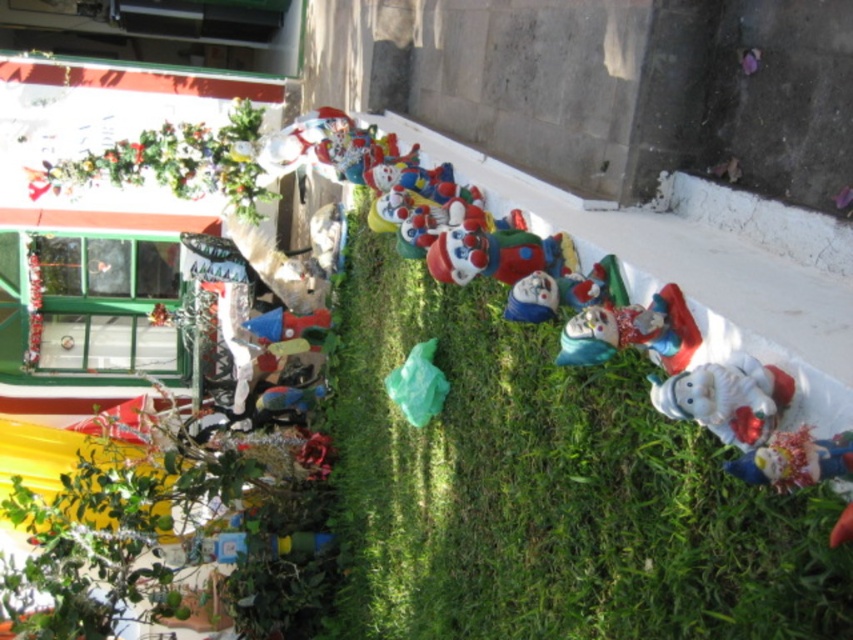
Question: Where is white glossy santa at lower right located in relation to shiny metallic clown at lower right in the image?

Choices:
 (A) above
 (B) below

Answer: (A)

Question: Which of the following is the farthest from the observer?

Choices:
 (A) (535, 624)
 (B) (674, 340)

Answer: (A)

Question: Can you confirm if green grass at center is positioned to the left of white glossy santa at lower right?

Choices:
 (A) yes
 (B) no

Answer: (A)

Question: Among these objects, which one is nearest to the camera?

Choices:
 (A) matte plastic clown at center
 (B) shiny metallic clown at lower right

Answer: (B)

Question: Can you confirm if green grass at center is positioned to the left of shiny metallic clown at lower right?

Choices:
 (A) no
 (B) yes

Answer: (B)

Question: Which is nearer to the white glossy santa at lower right?

Choices:
 (A) matte plastic clown at center
 (B) green grass at center

Answer: (A)